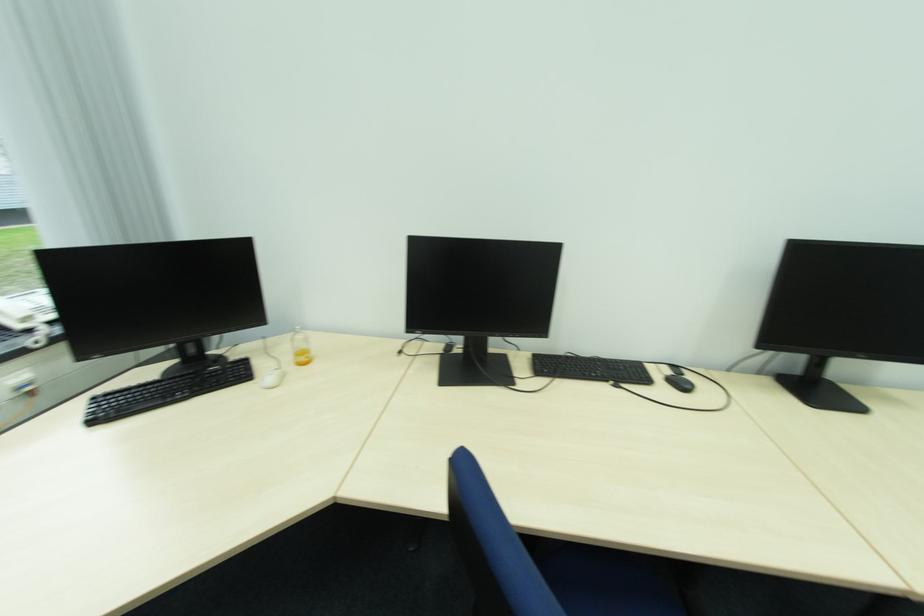
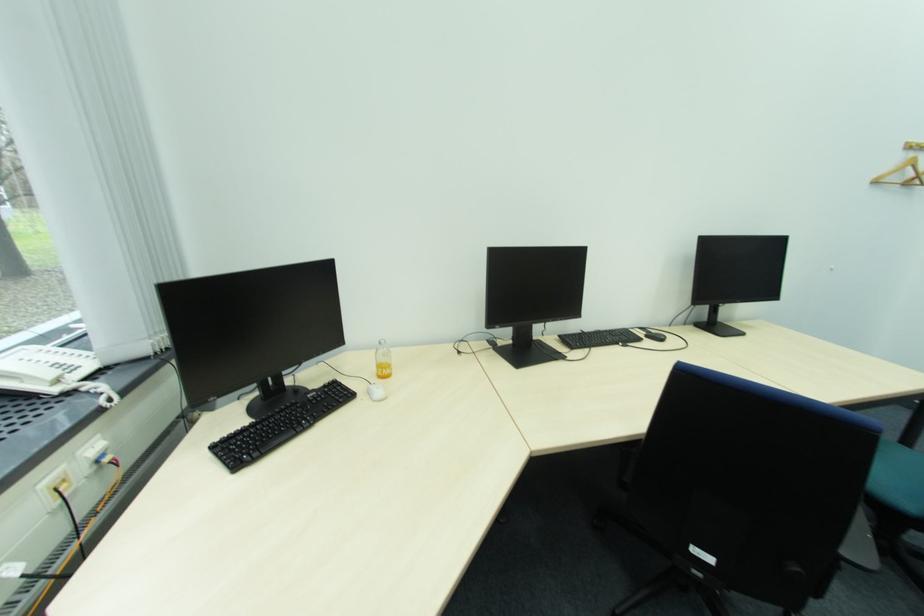
Question: Which direction would the cameraman need to move to produce the second image? Reply with the corresponding letter.

Choices:
 (A) Left
 (B) Right
 (C) Forward
 (D) Backward

Answer: (A)